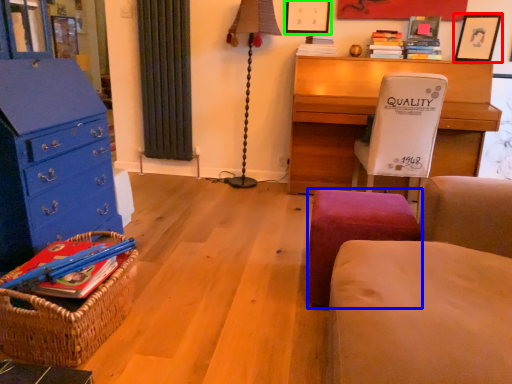
Question: Considering the real-world distances, which object is farthest from picture frame (highlighted by a red box)? stool (highlighted by a blue box) or picture frame (highlighted by a green box)?

Choices:
 (A) stool
 (B) picture frame

Answer: (A)